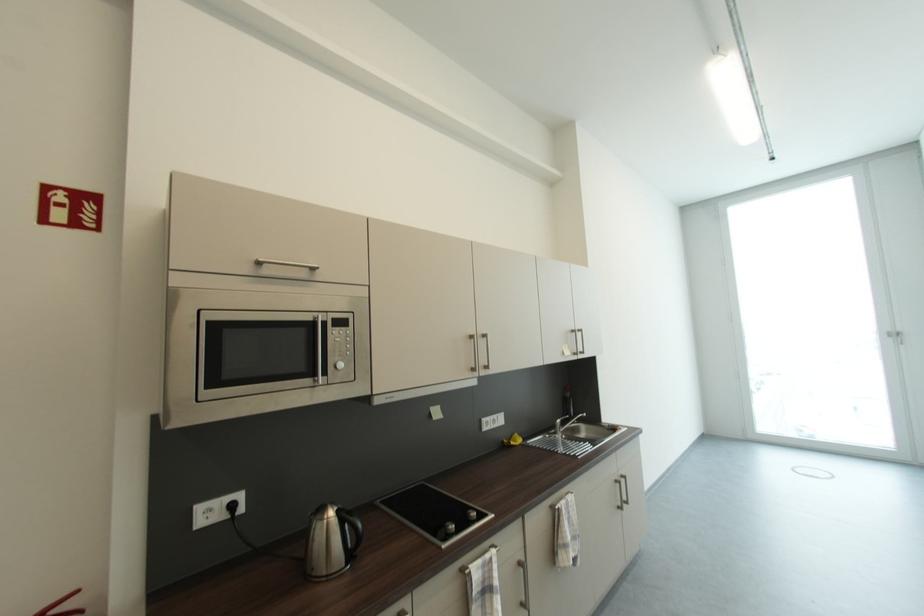
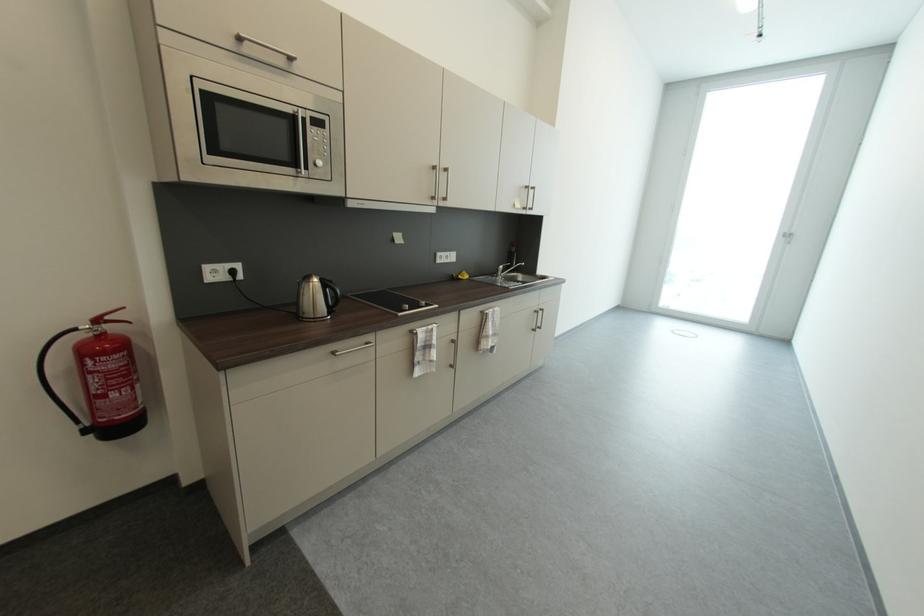
Where in the second image is the point corresponding to pixel 572 357 from the first image?

(523, 209)